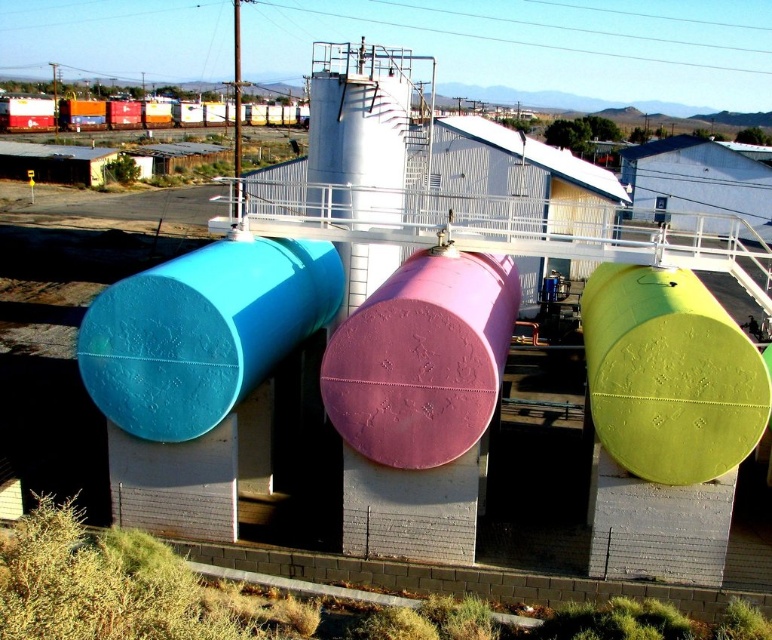
You are a maintenance worker standing at the camera position. You need to retrieve the matte blue barrel at center left. Can you reach it without moving from your current position?

The matte blue barrel at center left is 46.17 feet away from camera, so you cannot reach it without moving from your current position.

You are a maintenance worker needing to transport a tool box from the walkway to the ground. The tool box requires placing it on a stable surface. Which object between the matte blue barrel at center left and the green matte tank at center would be more suitable for placing the tool box?

The matte blue barrel at center left might be wider than the green matte tank at center, so it could provide a more stable surface for placing the tool box.